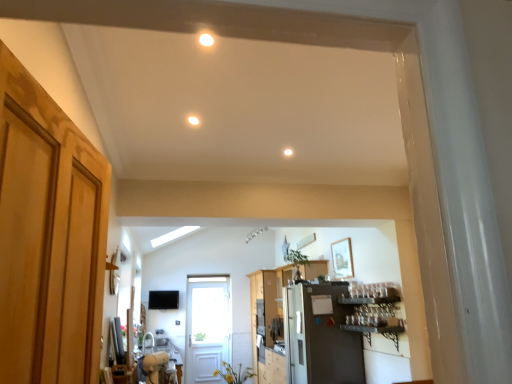
Find the location of a particular element. Image resolution: width=512 pixels, height=384 pixels. free spot to the left of white glossy light fixture at upper center, positioned as the 2th lighting in right-to-left order is located at coordinates (173, 46).